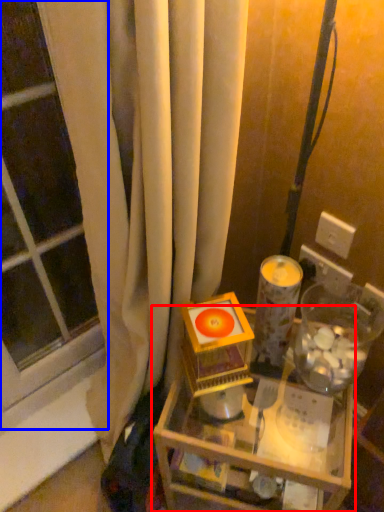
Question: Among these objects, which one is nearest to the camera, table (highlighted by a red box) or window (highlighted by a blue box)?

Choices:
 (A) table
 (B) window

Answer: (B)